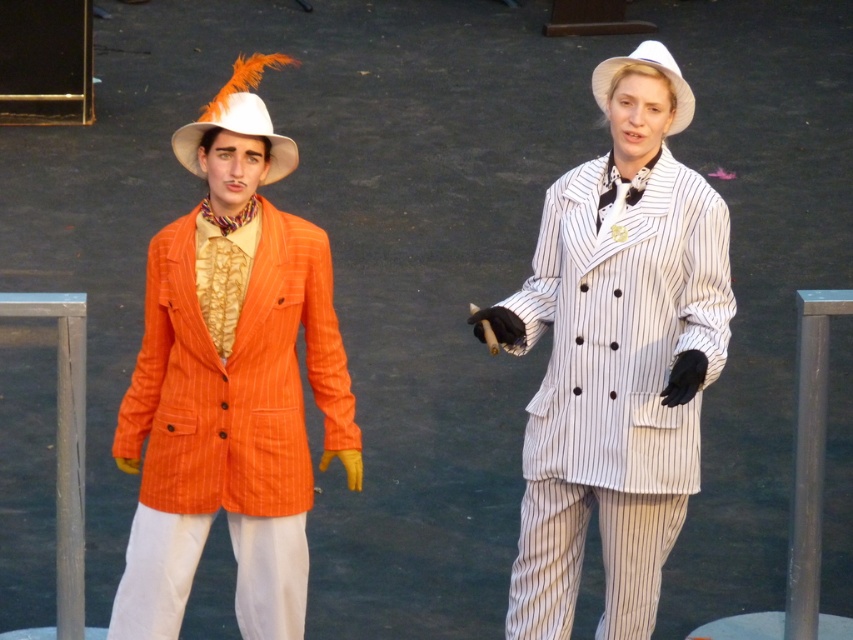
Question: Does orange pinstripe suit at left have a lesser width compared to matte white cowboy hat at left?

Choices:
 (A) yes
 (B) no

Answer: (B)

Question: Observing the image, what is the correct spatial positioning of orange pinstripe suit at left in reference to matte white cowboy hat at left?

Choices:
 (A) left
 (B) right

Answer: (A)

Question: Estimate the real-world distances between objects in this image. Which object is farther from the white matte cowboy hat at center?

Choices:
 (A) orange pinstripe suit at left
 (B) white pinstriped suit at center

Answer: (A)

Question: Does orange pinstripe suit at left have a smaller size compared to white matte cowboy hat at center?

Choices:
 (A) no
 (B) yes

Answer: (A)

Question: Which point is farther from the camera taking this photo?

Choices:
 (A) (688, 118)
 (B) (245, 76)
 (C) (608, 97)
 (D) (225, 209)

Answer: (C)

Question: Among these points, which one is nearest to the camera?

Choices:
 (A) (260, 76)
 (B) (677, 90)
 (C) (608, 109)
 (D) (223, 360)

Answer: (D)